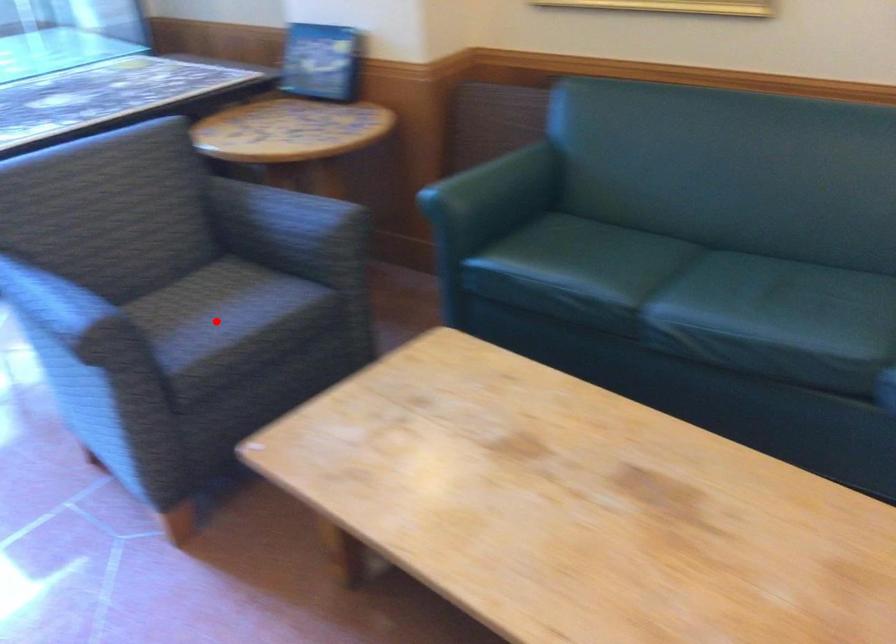
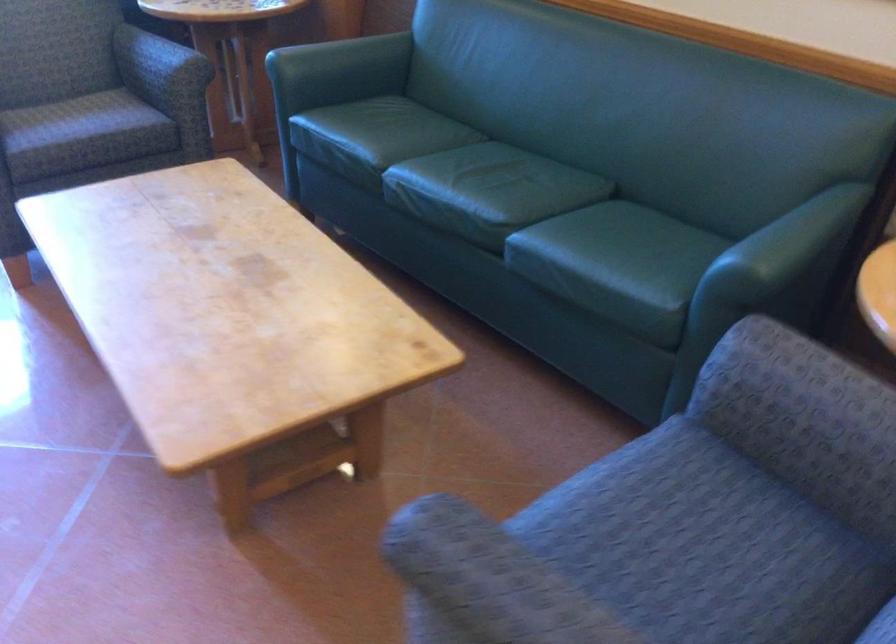
Locate, in the second image, the point that corresponds to the highlighted location in the first image.

(65, 118)